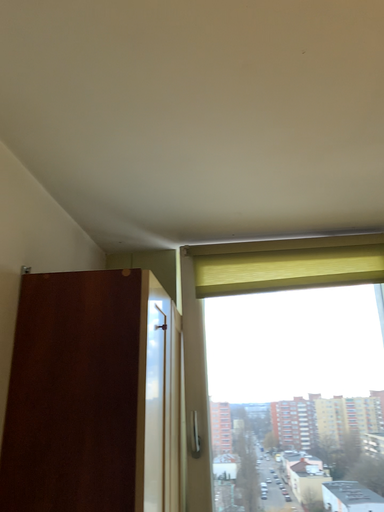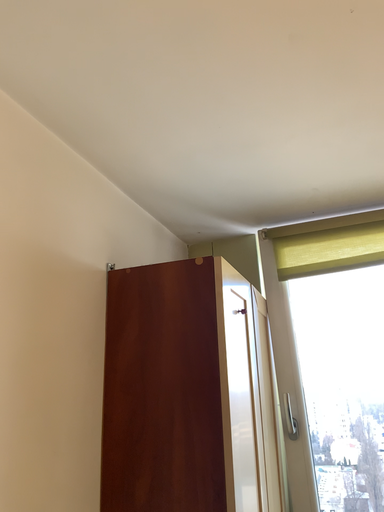
Question: Which way did the camera rotate in the video?

Choices:
 (A) rotated left
 (B) rotated right

Answer: (A)